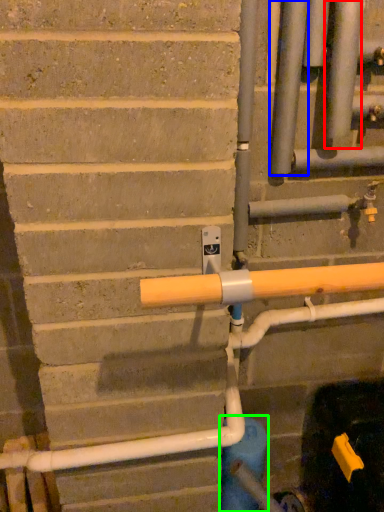
Question: Which object is the closest to the pipe (highlighted by a red box)? Choose among these: pipe (highlighted by a blue box) or water pipe (highlighted by a green box).

Choices:
 (A) pipe
 (B) water pipe

Answer: (A)